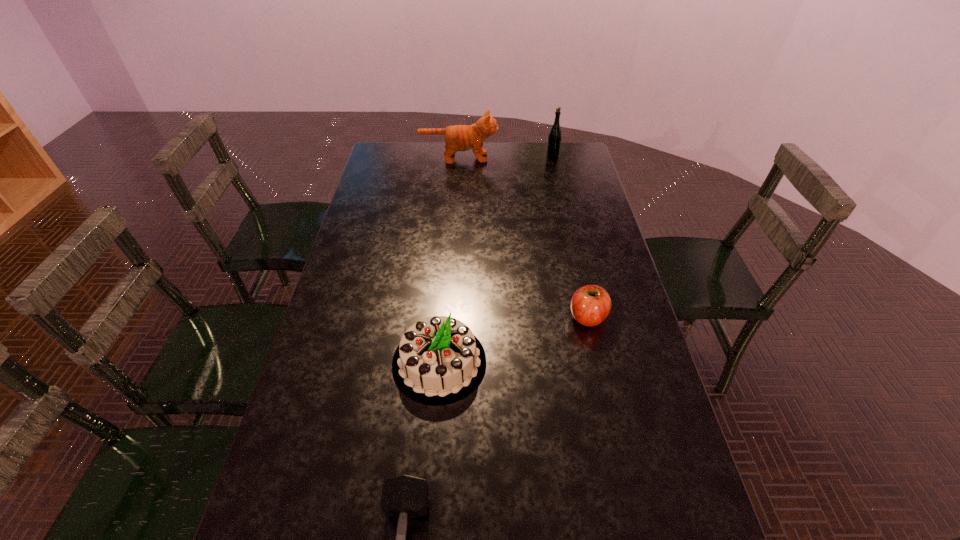
Image resolution: width=960 pixels, height=540 pixels. I want to click on beer bottle that is at the right edge, so click(x=554, y=139).

Locate an element on the screen. This screenshot has height=540, width=960. apple positioned at the right edge is located at coordinates (590, 305).

Find the location of a particular element. object located at the far right corner is located at coordinates (554, 139).

Locate an element on the screen. vacant region at the far edge of the desktop is located at coordinates (527, 145).

Locate an element on the screen. vacant space at the left edge of the desktop is located at coordinates (352, 373).

Locate an element on the screen. This screenshot has width=960, height=540. free space at the right edge is located at coordinates (592, 219).

I want to click on vacant region at the far right corner of the desktop, so click(x=581, y=167).

What are the coordinates of `free space between the third shortest object and the cat` in the screenshot? It's located at (449, 260).

This screenshot has height=540, width=960. Identify the location of unoccupied area between the apple and the third shortest object. (514, 340).

This screenshot has height=540, width=960. In order to click on vacant area that lies between the cat and the beer bottle in this screenshot , I will do `click(506, 157)`.